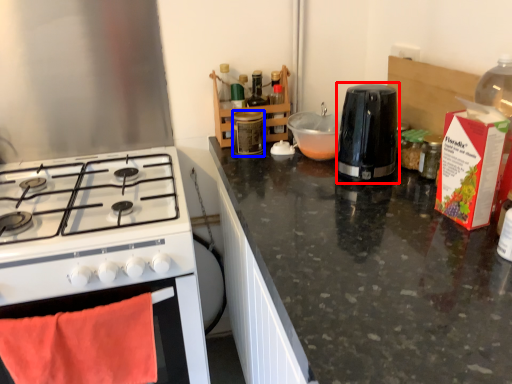
Question: Which object appears farthest to the camera in this image, kitchen appliance (highlighted by a red box) or bottle (highlighted by a blue box)?

Choices:
 (A) kitchen appliance
 (B) bottle

Answer: (B)